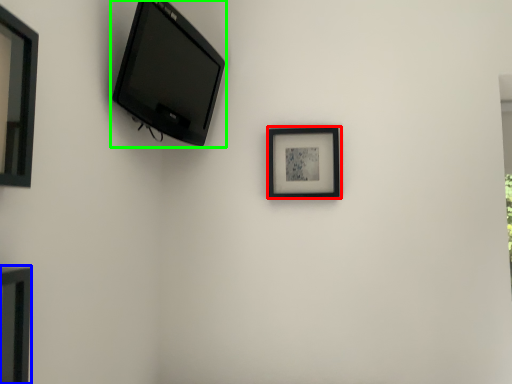
Question: Considering the real-world distances, which object is closest to picture frame (highlighted by a red box)? picture frame (highlighted by a blue box) or television (highlighted by a green box).

Choices:
 (A) picture frame
 (B) television

Answer: (B)